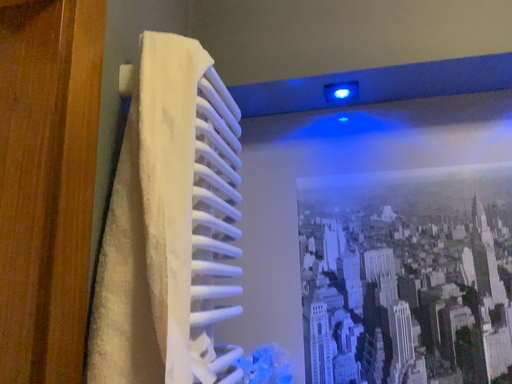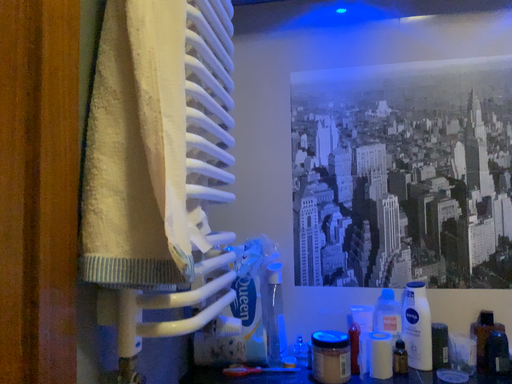
Question: Which way did the camera rotate in the video?

Choices:
 (A) rotated downward
 (B) rotated upward

Answer: (A)